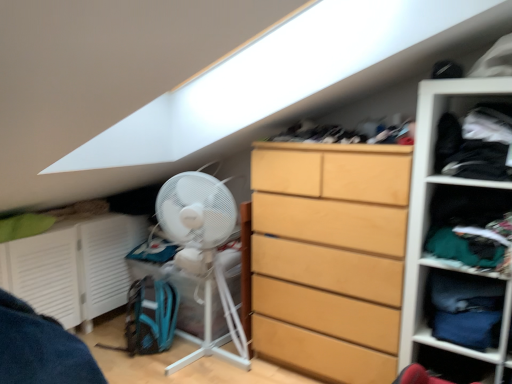
Question: Based on their sizes in the image, would you say light wood dresser at center is bigger or smaller than white plastic fan at left?

Choices:
 (A) big
 (B) small

Answer: (A)

Question: From a real-world perspective, is light wood dresser at center above or below white plastic fan at left?

Choices:
 (A) below
 (B) above

Answer: (B)

Question: Which object is positioned farthest from the white matte shelf at right?

Choices:
 (A) dark green fabric drawer at right, the 2th cabinet positioned from the left
 (B) dark fabric laundry at upper center
 (C) dark blue fabric at upper right, which ranks as the second clothing in bottom-to-top order
 (D) white plastic fan at left
 (E) dark blue fabric at right, which ranks as the 2th clothing in top-to-bottom order

Answer: (D)

Question: Which of these objects is positioned farthest from the dark blue fabric at upper right, placed as the 1th clothing when sorted from top to bottom?

Choices:
 (A) dark blue fabric at right, which ranks as the 2th clothing in top-to-bottom order
 (B) dark green fabric drawer at right, the 1th cabinet viewed from the right
 (C) light wood dresser at center
 (D) white plastic fan at left
 (E) white matte fan at lower left, the 2th cabinet positioned from the right

Answer: (E)